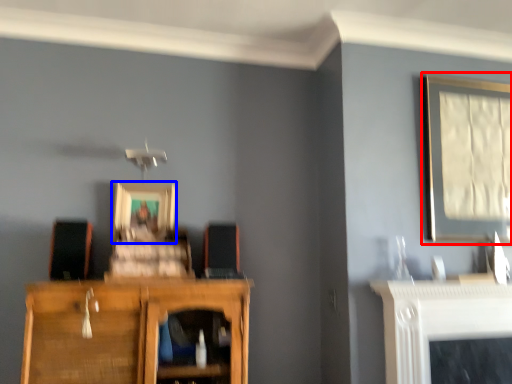
Question: Which point is closer to the camera, picture frame (highlighted by a red box) or picture frame (highlighted by a blue box)?

Choices:
 (A) picture frame
 (B) picture frame

Answer: (A)